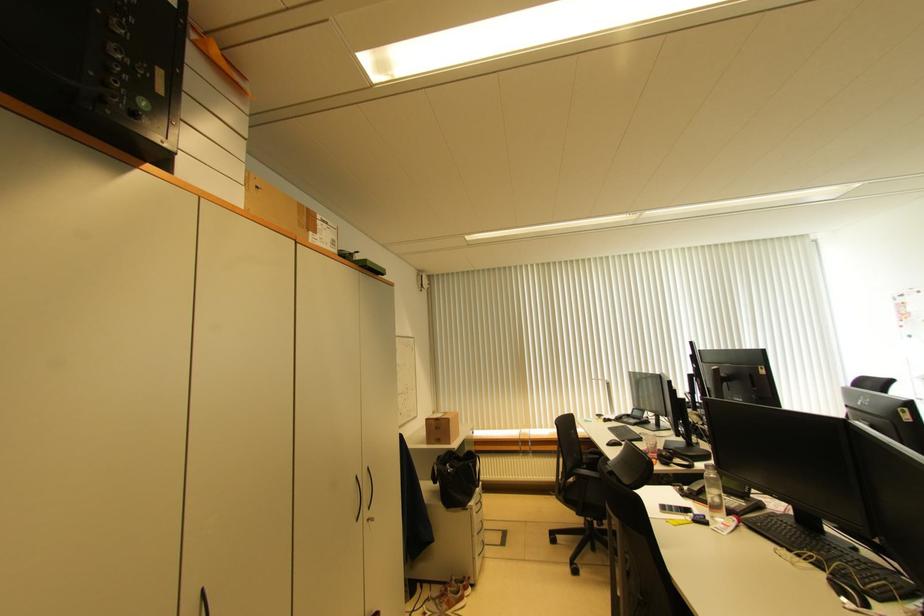
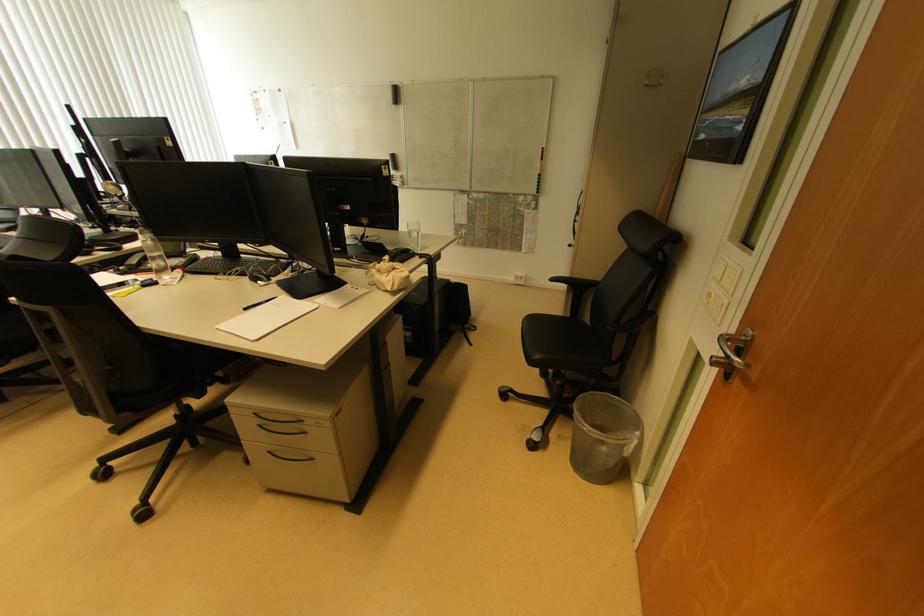
Locate, in the second image, the point that corresponds to point (720, 492) in the first image.

(161, 254)